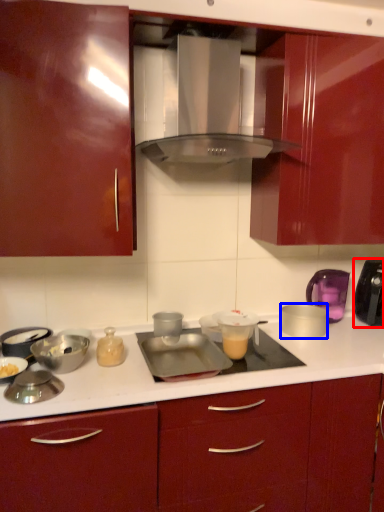
Question: Which object is closer to the camera taking this photo, kitchen appliance (highlighted by a red box) or appliance (highlighted by a blue box)?

Choices:
 (A) kitchen appliance
 (B) appliance

Answer: (B)